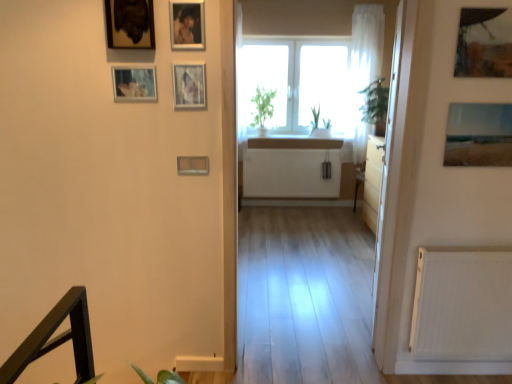
Question: Considering the positions of metallic photo frame at upper center, placed as the 4th picture frame when sorted from right to left, and transparent glass door at right in the image, is metallic photo frame at upper center, placed as the 4th picture frame when sorted from right to left, taller or shorter than transparent glass door at right?

Choices:
 (A) short
 (B) tall

Answer: (A)

Question: From a real-world perspective, is metallic photo frame at upper center, arranged as the 4th picture frame when viewed from the left, positioned above or below transparent glass door at right?

Choices:
 (A) above
 (B) below

Answer: (A)

Question: Considering the real-world distances, which object is farthest from the transparent glass door at right?

Choices:
 (A) white matte radiator at right
 (B) matte plastic picture frame at center, which ranks as the fifth picture frame in right-to-left order
 (C) metallic silver picture frame at upper center, which ranks as the 3th picture frame in right-to-left order
 (D) wooden framed painting at upper left, which appears as the 2th picture frame when viewed from the left
 (E) metallic silver picture frame at upper left, the first picture frame in the left-to-right sequence

Answer: (D)

Question: Which is nearer to the metallic silver picture frame at upper left, the first picture frame in the left-to-right sequence?

Choices:
 (A) metallic silver picture frame at upper center, which appears as the 5th picture frame when viewed from the left
 (B) transparent glass door at right
 (C) metallic reflective photo frame at upper right, which appears as the 6th picture frame when viewed from the left
 (D) white matte radiator at right
 (E) metallic photo frame at upper center, placed as the 4th picture frame when sorted from right to left

Answer: (A)